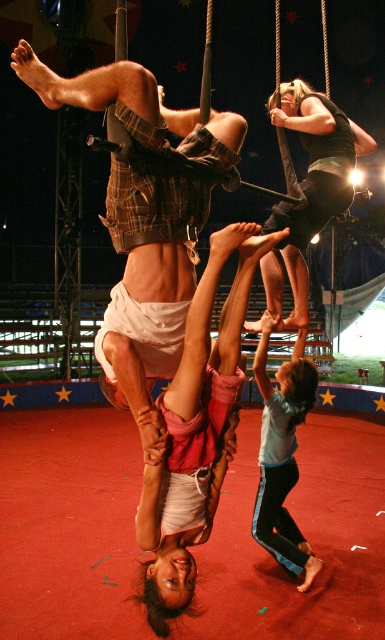
Is light blue fabric pants at lower right bigger than black fabric swing at upper center?

No.

Can you confirm if light blue fabric pants at lower right is positioned to the left of black fabric swing at upper center?

Indeed, light blue fabric pants at lower right is positioned on the left side of black fabric swing at upper center.

Identify the location of light blue fabric pants at lower right. The width and height of the screenshot is (385, 640). (281, 458).

You are a GUI agent. You are given a task and a screenshot of the screen. Output one action in this format:
    pyautogui.click(x=<x>, y=<y>)
    Task: Click on the light blue fabric pants at lower right
    The height and width of the screenshot is (640, 385).
    Given the screenshot: What is the action you would take?
    pyautogui.click(x=281, y=458)